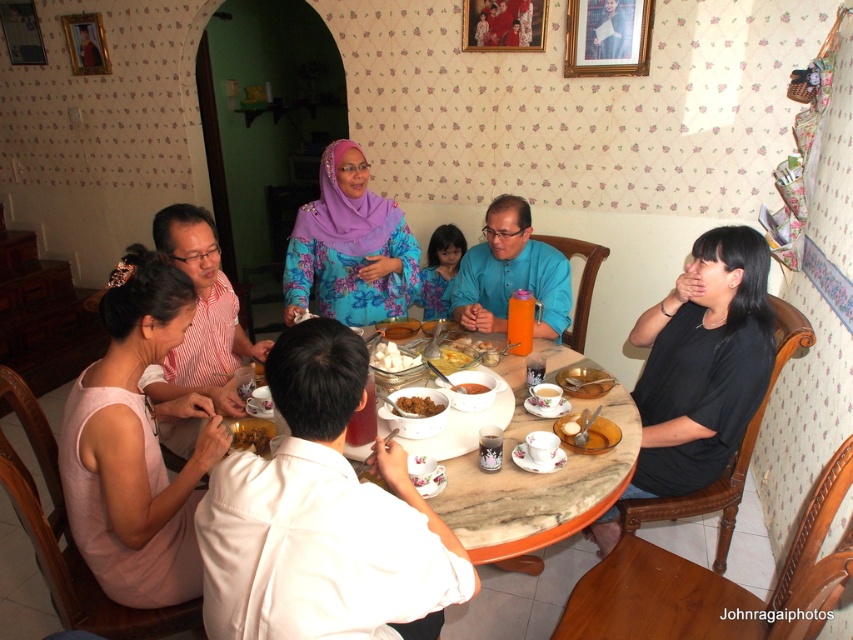
Question: In this image, where is blue satin blouse at center located relative to brown crumbly bread at center?

Choices:
 (A) below
 (B) above

Answer: (B)

Question: Which point appears closest to the camera in this image?

Choices:
 (A) tap(550, 589)
 (B) tap(358, 536)
 (C) tap(132, 504)

Answer: (B)

Question: Is marble table at center wider than floral fabric hijab at center?

Choices:
 (A) yes
 (B) no

Answer: (B)

Question: Estimate the real-world distances between objects in this image. Which object is farther from the smooth brown rice at center?

Choices:
 (A) white glossy rice at center
 (B) pink fabric dress at lower left
 (C) brown matte food at center

Answer: (B)

Question: Estimate the real-world distances between objects in this image. Which object is closer to the floral fabric hijab at center?

Choices:
 (A) brown matte food at center
 (B) smooth white rice at center

Answer: (A)

Question: Is the position of matte white table at center less distant than that of brown matte food at center?

Choices:
 (A) yes
 (B) no

Answer: (B)